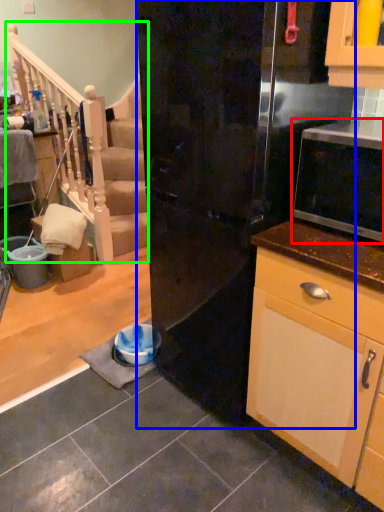
Question: Which object is positioned closest to microwave oven (highlighted by a red box)? Select from refrigerator (highlighted by a blue box) and rail (highlighted by a green box).

Choices:
 (A) refrigerator
 (B) rail

Answer: (A)